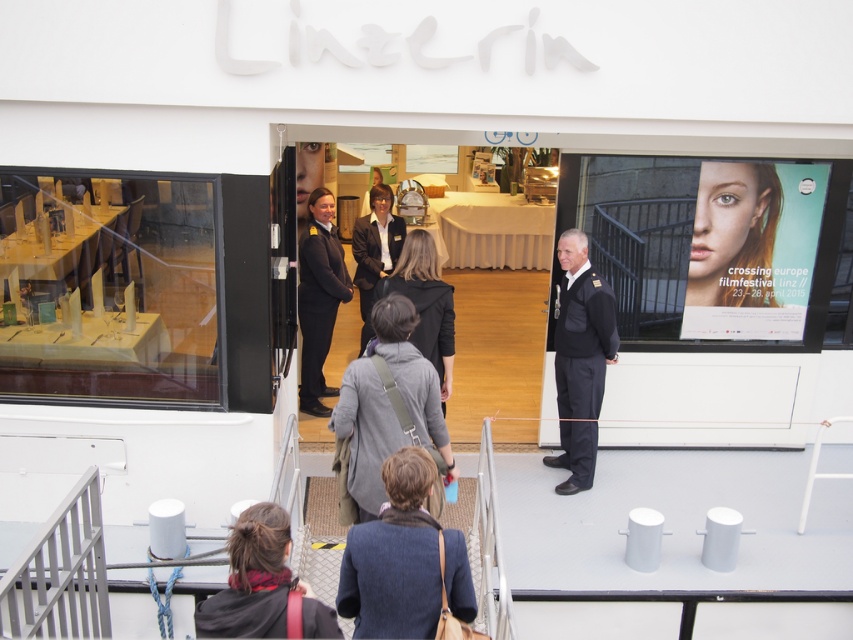
Which is more to the right, blue wool coat at lower center or dark blue fabric business suit at center?

blue wool coat at lower center is more to the right.

Is blue wool coat at lower center smaller than dark blue fabric business suit at center?

Indeed, blue wool coat at lower center has a smaller size compared to dark blue fabric business suit at center.

Which is behind, point (416, 532) or point (310, 273)?

The point (310, 273) is more distant.

Locate an element on the screen. This screenshot has height=640, width=853. blue wool coat at lower center is located at coordinates (403, 561).

From the picture: Is shiny black uniform at center below dark gray wool business suit at center?

Correct, shiny black uniform at center is located below dark gray wool business suit at center.

Between shiny black uniform at center and dark gray wool business suit at center, which one has less height?

With less height is dark gray wool business suit at center.

Find the location of a particular element. The image size is (853, 640). shiny black uniform at center is located at coordinates (579, 358).

Is smooth skin face at upper right taller than shiny black uniform at center?

No.

Which is more to the left, smooth skin face at upper right or shiny black uniform at center?

shiny black uniform at center

Where is `smooth skin face at upper right`? smooth skin face at upper right is located at coordinates (733, 234).

Find the location of a particular element. Image resolution: width=853 pixels, height=640 pixels. smooth skin face at upper right is located at coordinates (733, 234).